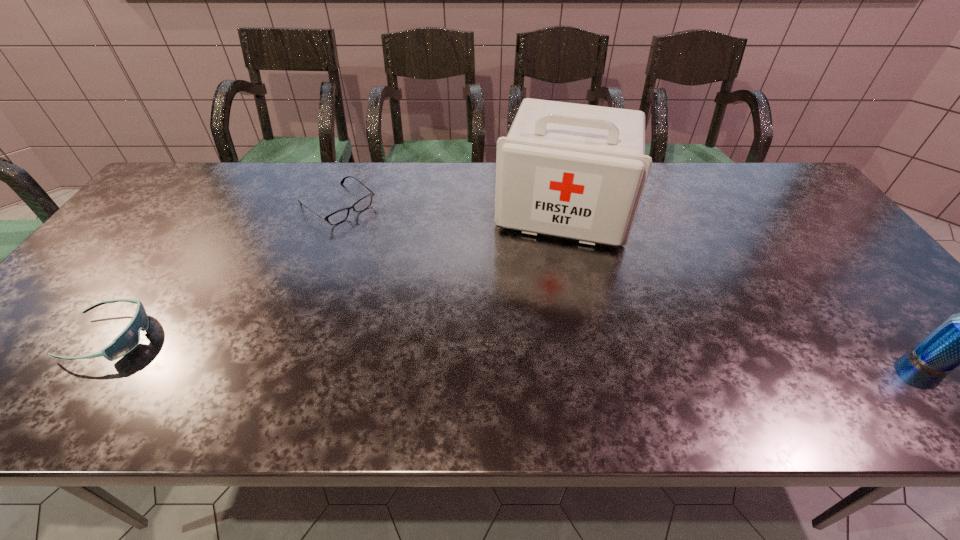
The image size is (960, 540). Find the location of `vacant region at the right edge of the desktop`. vacant region at the right edge of the desktop is located at coordinates (854, 284).

Locate an element on the screen. vacant space at the far left corner of the desktop is located at coordinates (186, 165).

Find the location of `vacant region at the near left corner of the desktop`. vacant region at the near left corner of the desktop is located at coordinates pyautogui.click(x=31, y=370).

The height and width of the screenshot is (540, 960). What are the coordinates of `vacant area at the far right corner of the desktop` in the screenshot? It's located at (774, 165).

The height and width of the screenshot is (540, 960). I want to click on free space between the third tallest object and the third object from right to left, so click(224, 272).

At what (x,y) coordinates should I click in order to perform the action: click on free point between the leftmost object and the shortest object. Please return your answer as a coordinate pair (x, y). This screenshot has width=960, height=540. Looking at the image, I should click on (224, 272).

This screenshot has width=960, height=540. I want to click on free space between the first-aid kit and the shortest object, so click(x=450, y=208).

The image size is (960, 540). Identify the location of empty location between the leftmost object and the tallest object. (336, 274).

Where is `free space that is in between the first-aid kit and the spectacles`? free space that is in between the first-aid kit and the spectacles is located at coordinates (450, 208).

At what (x,y) coordinates should I click in order to perform the action: click on object that is the closest to the rightmost object. Please return your answer as a coordinate pair (x, y). The width and height of the screenshot is (960, 540). Looking at the image, I should click on (577, 171).